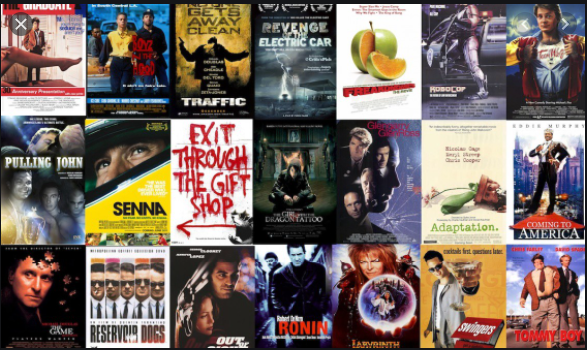
At what (x,y) coordinates should I click in order to perform the action: click on total number of movie posters on the right 2 rows. Please return your answer as a coordinate pair (x, y). Image resolution: width=587 pixels, height=350 pixels. Looking at the image, I should click on (468, 300), (543, 289), (460, 184), (553, 177), (458, 48), (546, 60).